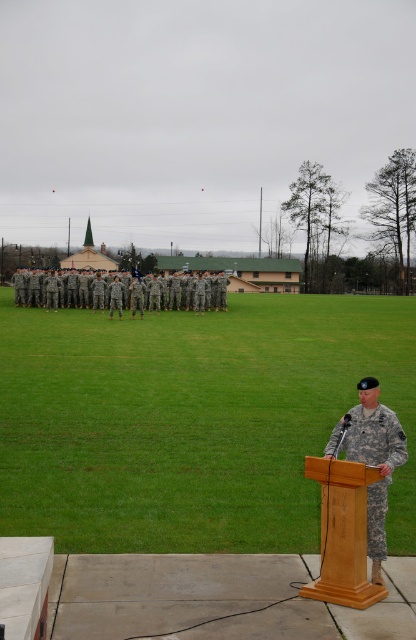
Consider the image. You are a photographer positioned at the center of the field. You need to capture a photo that includes both the wooden podium at lower right and the camouflage fabric uniform at right. Based on their positions, which object should you pan your camera towards first to ensure both are in frame?

You should pan your camera towards the wooden podium at lower right first because it is to the left of the camouflage fabric uniform at right, so starting there will allow both objects to be captured in the frame.

Based on the photo, you are a photographer positioned at the front of the ceremony. You need to capture a photo that includes both the wooden podium at lower right and the camouflage uniform at center. Which object will appear larger in your photo?

The wooden podium at lower right will appear larger in the photo because it is closer to the viewer than the camouflage uniform at center.

You are a photographer positioned at the back of the ceremony. You need to capture a closeup shot of the wooden podium at lower right and the camouflage fabric uniform at right. Given that your camera has a fixed focal length lens, which object should you move closer to in order to focus on it properly?

The wooden podium at lower right is wider than the camouflage fabric uniform at right, so you should move closer to the camouflage fabric uniform at right to focus properly.